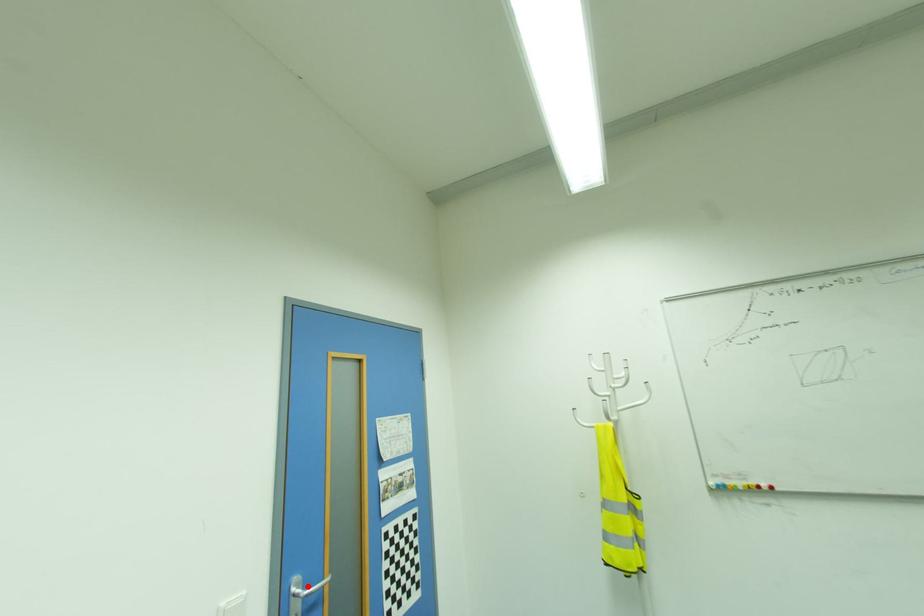
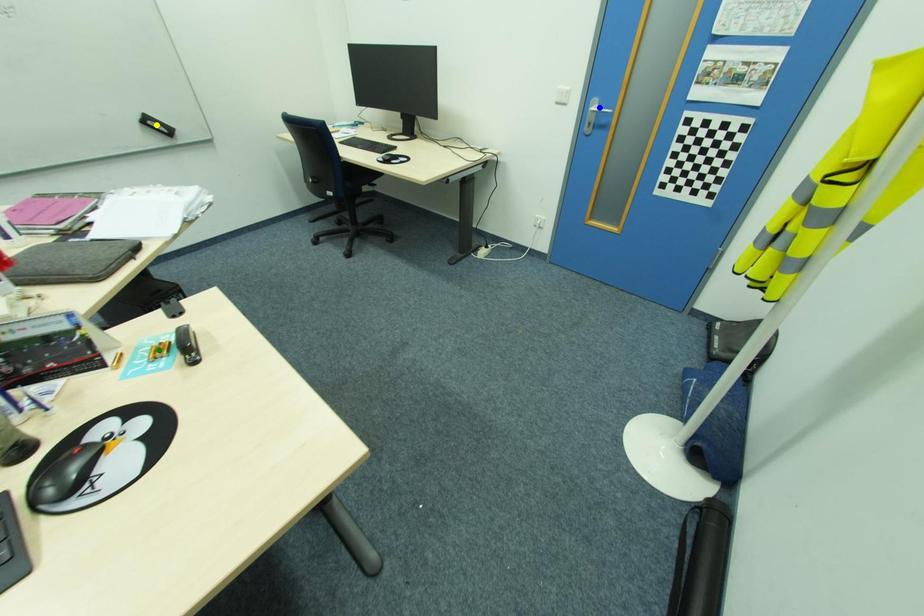
Question: I am providing you with two images of the same scene from different viewpoints. A red point is marked on the first image. You are given multiple points on the second image. Can you choose the point in image 2 that corresponds to the point in image 1?

Choices:
 (A) blue point
 (B) yellow point
 (C) green point

Answer: (A)